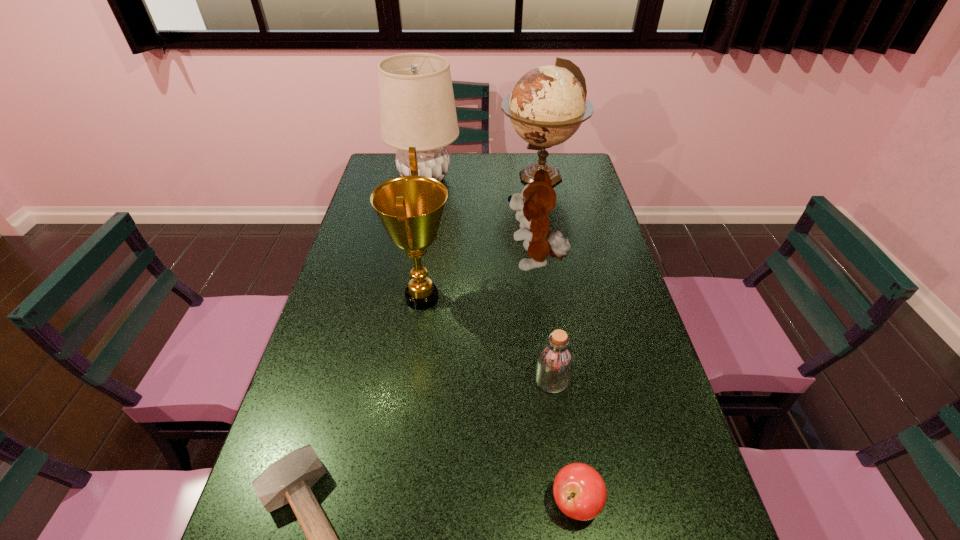
The image size is (960, 540). What are the coordinates of `object present at the right edge` in the screenshot? It's located at (548, 104).

The height and width of the screenshot is (540, 960). What are the coordinates of `object located at the far left corner` in the screenshot? It's located at (417, 108).

Find the location of a particular element. This screenshot has height=540, width=960. object situated at the far right corner is located at coordinates [548, 104].

Where is `blank space at the left edge of the desktop`? The width and height of the screenshot is (960, 540). blank space at the left edge of the desktop is located at coordinates (313, 418).

The height and width of the screenshot is (540, 960). I want to click on vacant space at the right edge of the desktop, so click(x=612, y=295).

At what (x,y) coordinates should I click in order to perform the action: click on empty space that is in between the lampshade and the fourth shortest object. Please return your answer as a coordinate pair (x, y). Looking at the image, I should click on (480, 220).

The width and height of the screenshot is (960, 540). What are the coordinates of `vacant region between the award and the sixth tallest object` in the screenshot? It's located at (499, 400).

At what (x,y) coordinates should I click in order to perform the action: click on vacant space that's between the lampshade and the bottle. Please return your answer as a coordinate pair (x, y). Image resolution: width=960 pixels, height=540 pixels. Looking at the image, I should click on (488, 279).

Locate an element on the screen. This screenshot has width=960, height=540. free space between the sixth tallest object and the award is located at coordinates (499, 400).

The width and height of the screenshot is (960, 540). In order to click on free point between the award and the apple in this screenshot , I will do `click(499, 400)`.